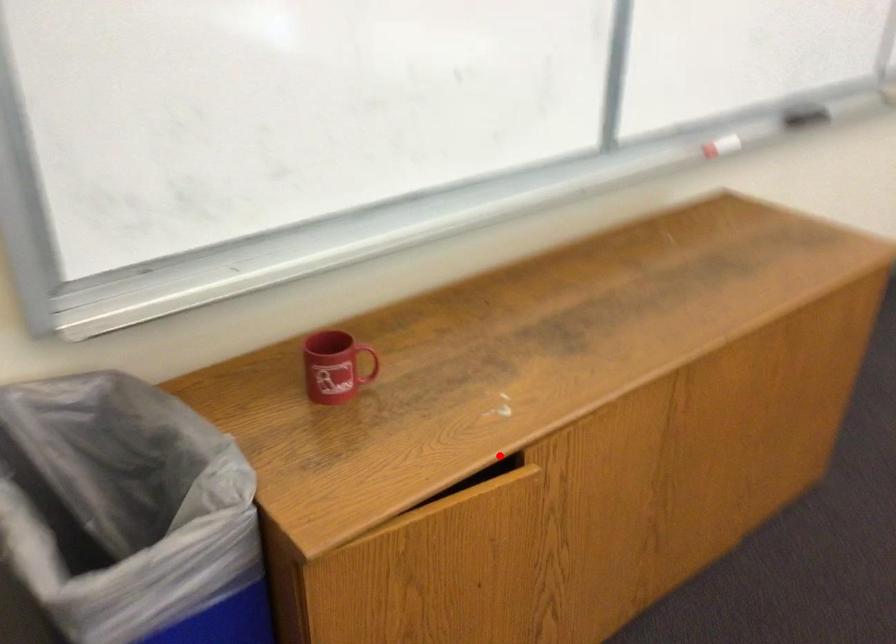
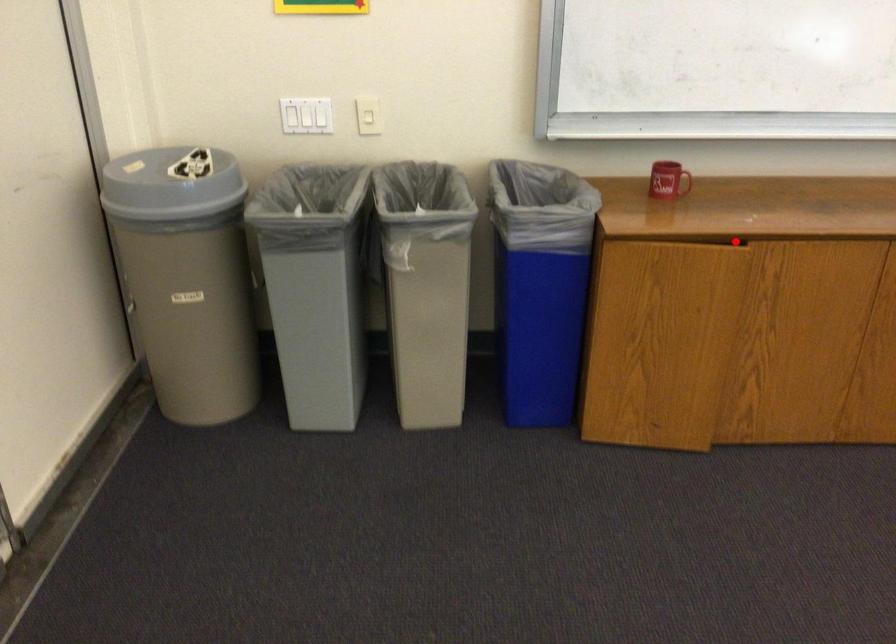
I am providing you with two images of the same scene from different viewpoints. A red point is marked on the first image and another point is marked on the second image. Does the point marked in image1 correspond to the same location as the one in image2?

Yes